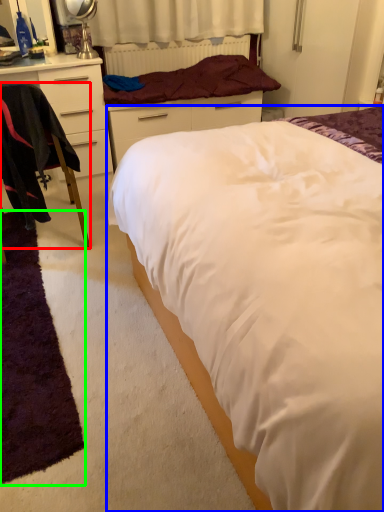
Question: Considering the real-world distances, which object is closest to chair (highlighted by a red box)? bed (highlighted by a blue box) or mat (highlighted by a green box).

Choices:
 (A) bed
 (B) mat

Answer: (B)